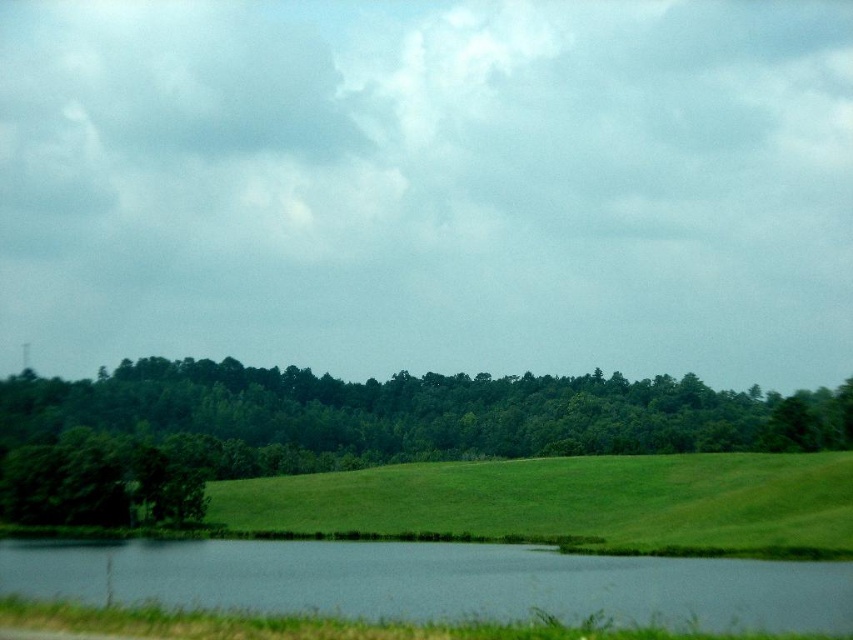
You are standing in the middle of the scene and want to walk towards the green grassy lake at lower center. Will you first encounter the green leafy trees at center before reaching the lake?

→ The green leafy trees at center are further to the viewer than the green grassy lake at lower center, so you will first encounter the green leafy trees at center before reaching the lake.

Consider the image. You are standing at the edge of the pond in the rural landscape scene. You see two points marked in the image. Which point is closer to you, point [196,422] or point [456,545]?

Point [196,422] is closer to you because it is further to the viewer than point [456,545].

You are standing at the edge of the pond in the rural landscape scene. You notice a point marked at coordinates (x=405, y=417). What is located at that point?

The point at coordinates (x=405, y=417) indicates green leafy trees at center.